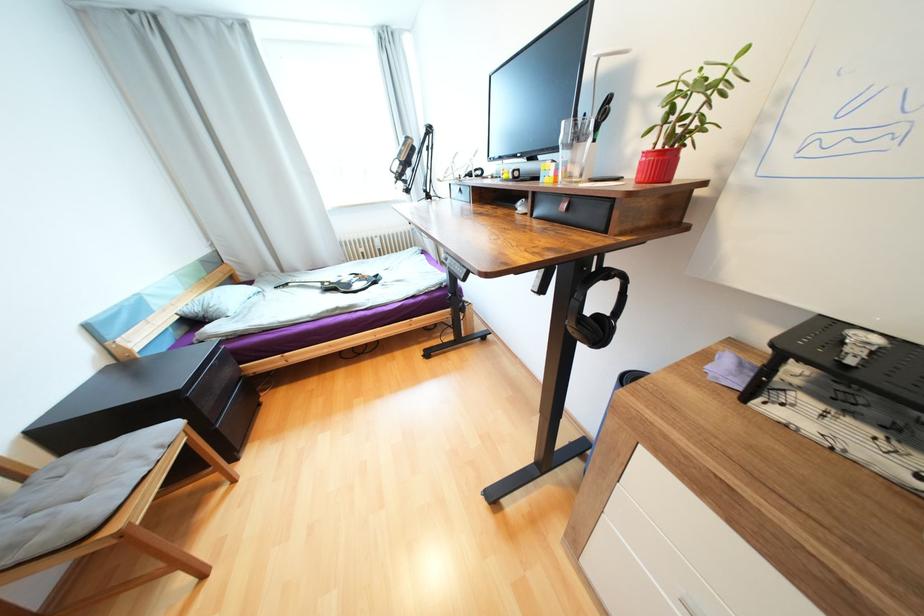
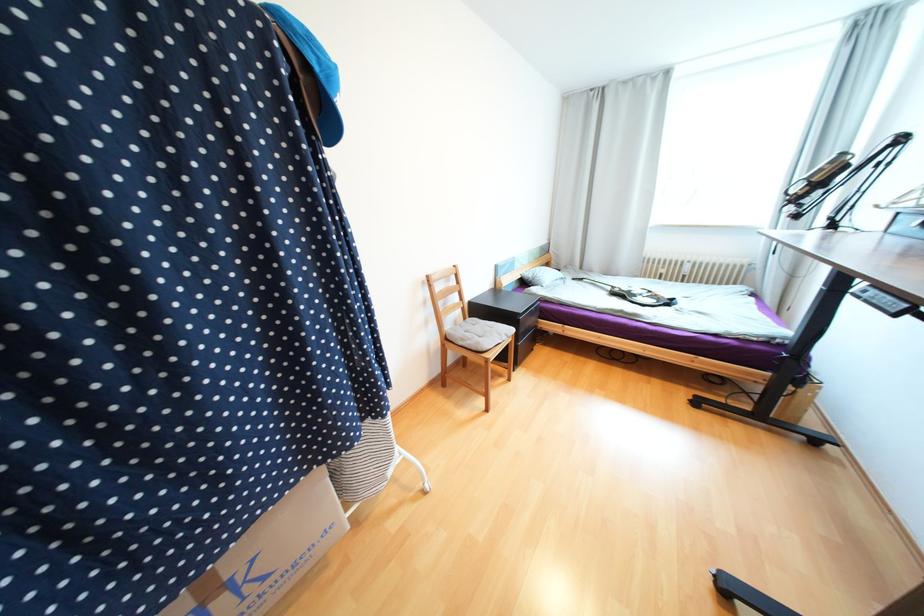
The point at (147, 458) is marked in the first image. Where is the corresponding point in the second image?

(505, 334)